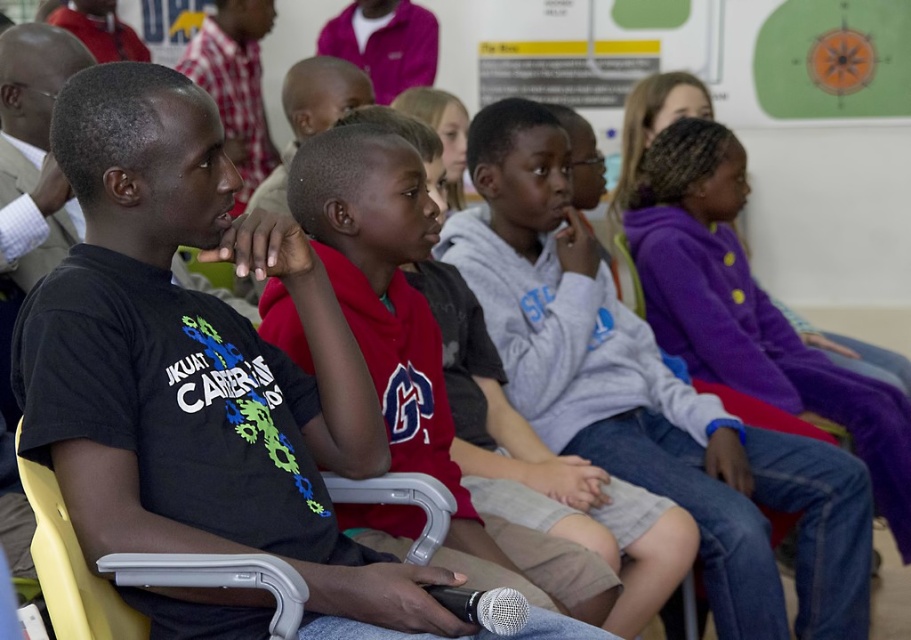
You are a tailor who needs to determine if the purple fleece jacket at center can fit into a storage box designed to hold items wider than the silver metallic microphone at lower center. Can the jacket fit?

The purple fleece jacket at center is wider than the silver metallic microphone at lower center, so it can fit into the storage box designed for items wider than the microphone.

You are a photographer trying to capture a group photo of the children in the classroom. You notice the purple fleece jacket at center and the red matte shirt at center. Which clothing item should you focus on to ensure it appears larger in the photo?

The purple fleece jacket at center is much taller than the red matte shirt at center, so focusing on it will make it appear larger in the photo.

You are a student in the classroom and need to locate the purple fleece jacket at center. Based on the coordinates provided, where should you look relative to the center of the image?

The purple fleece jacket at center is located at coordinates point (647,396), which means it is positioned to the right and slightly below the center of the image.